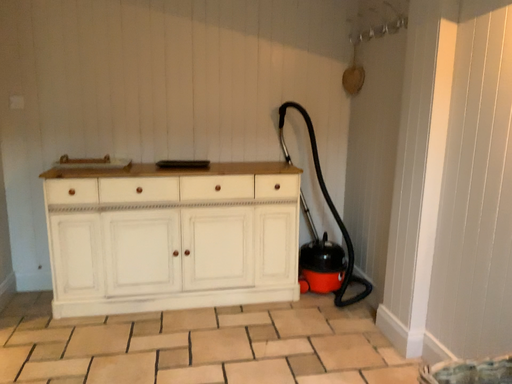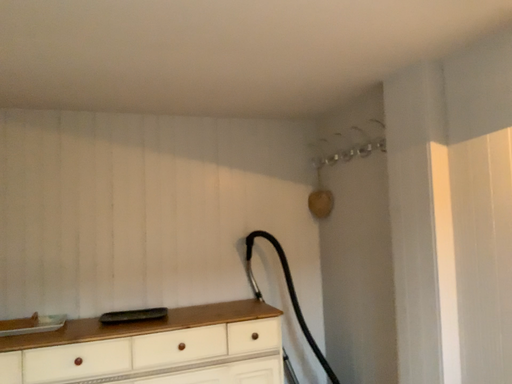
Question: How did the camera likely rotate when shooting the video?

Choices:
 (A) rotated upward
 (B) rotated downward

Answer: (A)